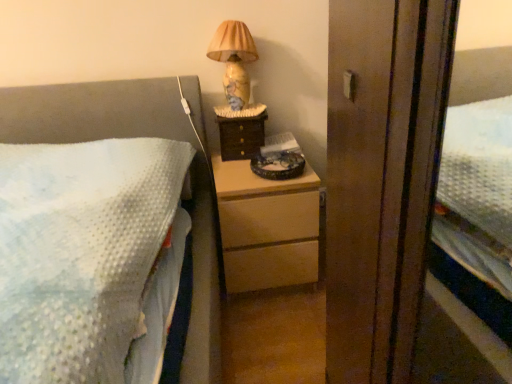
The image size is (512, 384). I want to click on vacant space underneath marble-patterned lampshade at upper right (from a real-world perspective), so click(238, 107).